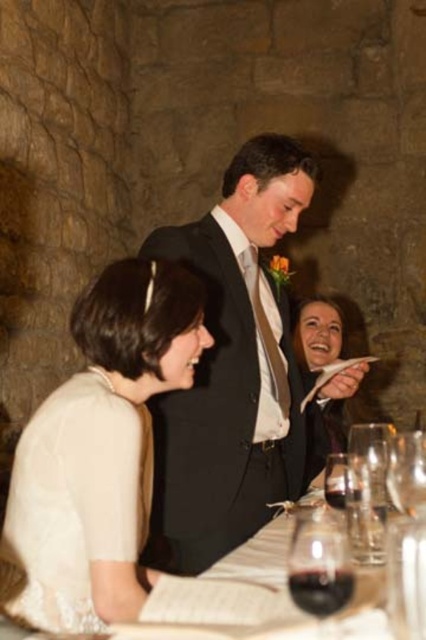
Question: Which object is the closest to the translucent glass wine at lower center?

Choices:
 (A) black satin suit at center
 (B) white satin dress at lower left

Answer: (B)

Question: Which point appears farthest from the camera in this image?

Choices:
 (A) (347, 499)
 (B) (333, 582)
 (C) (65, 625)

Answer: (C)

Question: Does white satin dress at lower left lie behind smooth beige dress at lower center?

Choices:
 (A) yes
 (B) no

Answer: (B)

Question: Does translucent glass wine at lower center have a greater width compared to dark red glass at table center?

Choices:
 (A) yes
 (B) no

Answer: (A)

Question: Is smooth beige dress at lower center wider than dark red glass at table center?

Choices:
 (A) no
 (B) yes

Answer: (B)

Question: Which point appears closest to the camera in this image?

Choices:
 (A) (328, 541)
 (B) (129, 612)

Answer: (A)